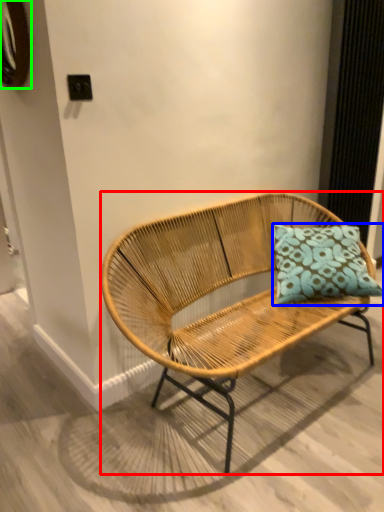
Question: Which object is the farthest from bench (highlighted by a red box)? Choose among these: pillow (highlighted by a blue box) or oval (highlighted by a green box).

Choices:
 (A) pillow
 (B) oval

Answer: (B)